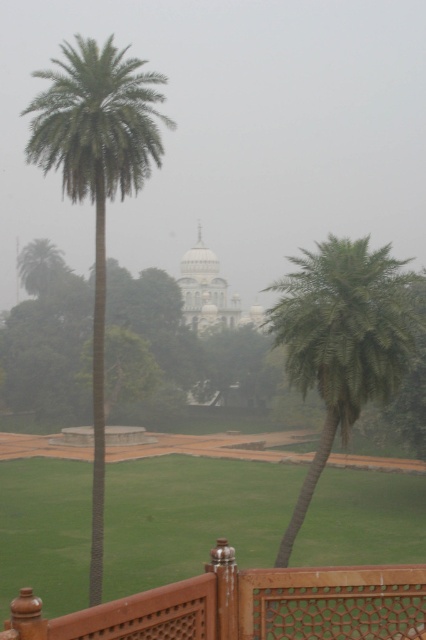
Question: Among these points, which one is farthest from the camera?

Choices:
 (A) (325, 449)
 (B) (118, 612)
 (C) (178, 276)
 (D) (57, 140)

Answer: (C)

Question: Which of these objects is positioned closest to the green leafy palm at left?

Choices:
 (A) green leafy palm at center
 (B) brown wooden fence at lower center
 (C) white marble palace at center

Answer: (A)

Question: Can you confirm if brown wooden fence at lower center is wider than green leafy palm at left?

Choices:
 (A) yes
 (B) no

Answer: (B)

Question: Does green leafy palm at left appear under white marble palace at center?

Choices:
 (A) yes
 (B) no

Answer: (B)

Question: Which object is farther from the camera taking this photo?

Choices:
 (A) green leafy palm at center
 (B) brown wooden fence at lower center

Answer: (A)

Question: Is green leafy palm at center below white marble palace at center?

Choices:
 (A) yes
 (B) no

Answer: (A)